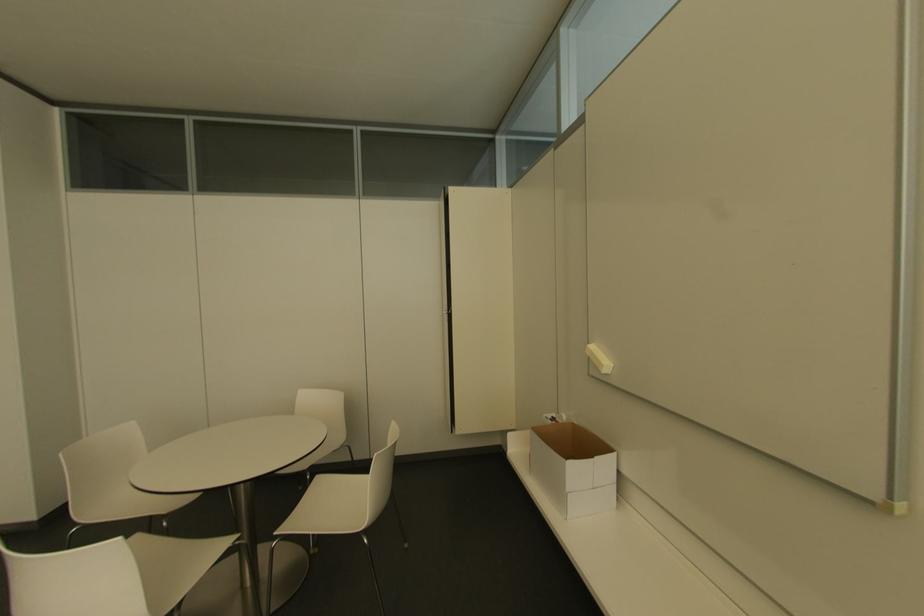
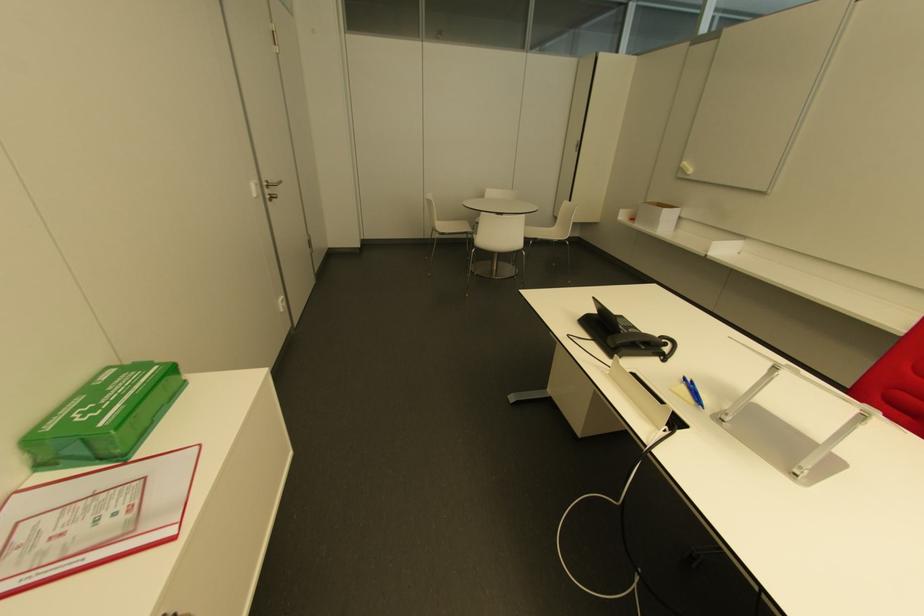
Find the pixel in the second image that matches pixel 363 533 in the first image.

(565, 240)